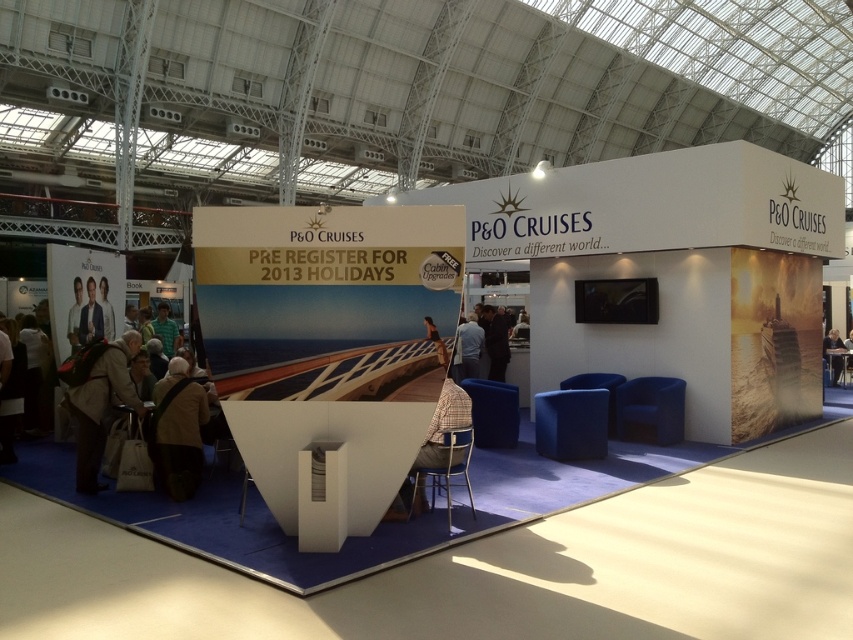
Between brown leather jacket at lower left and brown fabric bag at lower left, which one appears on the right side from the viewer's perspective?

From the viewer's perspective, brown leather jacket at lower left appears more on the right side.

Is brown leather jacket at lower left above brown fabric bag at lower left?

No, brown leather jacket at lower left is not above brown fabric bag at lower left.

Identify the location of brown leather jacket at lower left. This screenshot has width=853, height=640. pyautogui.click(x=177, y=429).

This screenshot has height=640, width=853. Find the location of `brown leather jacket at lower left`. brown leather jacket at lower left is located at coordinates (177, 429).

Who is shorter, brown leather jacket at lower left or light brown leather chair at lower right?

light brown leather chair at lower right is shorter.

Who is more distant from viewer, (x=198, y=428) or (x=838, y=358)?

Point (x=838, y=358)

The height and width of the screenshot is (640, 853). I want to click on brown leather jacket at lower left, so click(x=177, y=429).

Is brown fabric bag at lower left bigger than light brown leather chair at lower right?

No.

Who is taller, brown fabric bag at lower left or light brown leather chair at lower right?

brown fabric bag at lower left is taller.

I want to click on brown fabric bag at lower left, so click(x=102, y=404).